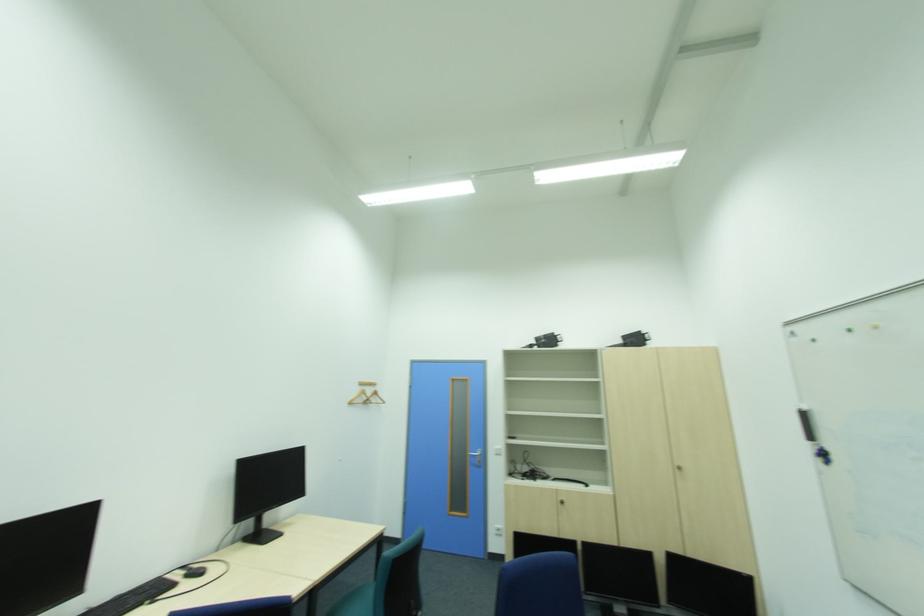
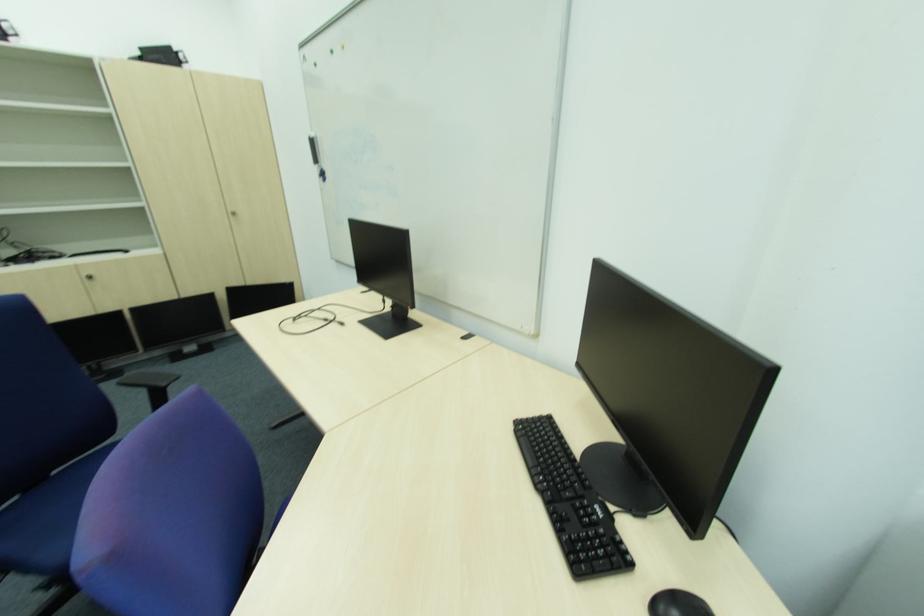
How did the camera likely rotate?

The camera rotated toward right-down.